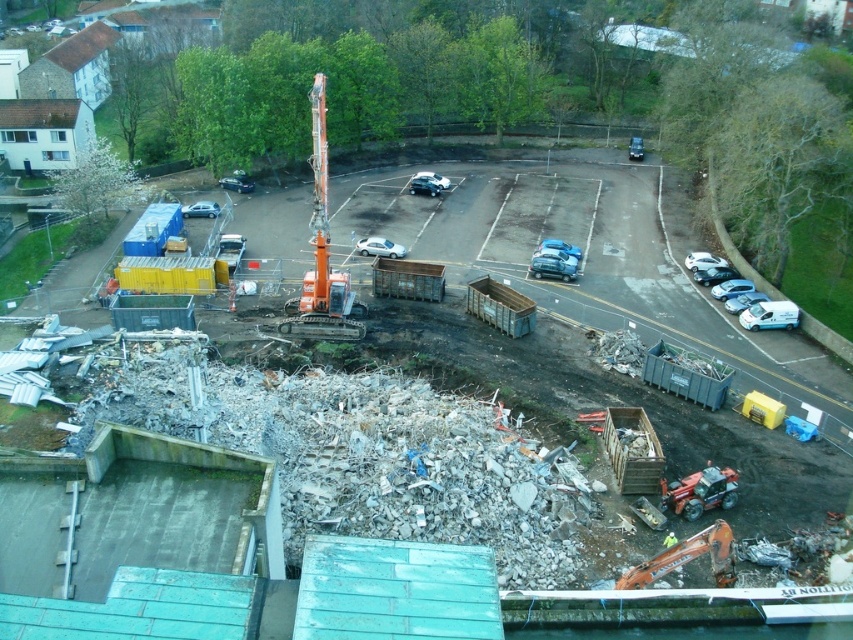
Question: Is silver metallic car at center bigger than metallic silver car at center?

Choices:
 (A) no
 (B) yes

Answer: (B)

Question: Which point appears closest to the camera in this image?

Choices:
 (A) (314, 284)
 (B) (199, 209)
 (C) (241, 184)

Answer: (A)

Question: Which of the following is the closest to the observer?

Choices:
 (A) (316, 332)
 (B) (554, 237)
 (C) (434, 195)

Answer: (A)

Question: Estimate the real-world distances between objects in this image. Which object is closer to the silver metallic car at center?

Choices:
 (A) satin silver sedan at center
 (B) metallic blue sedan at center
 (C) shiny black car at center

Answer: (C)

Question: Can you confirm if silver metallic car at center is positioned above metallic blue sedan at center?

Choices:
 (A) no
 (B) yes

Answer: (B)

Question: Does white matte car at center come in front of satin silver sedan at center?

Choices:
 (A) no
 (B) yes

Answer: (B)